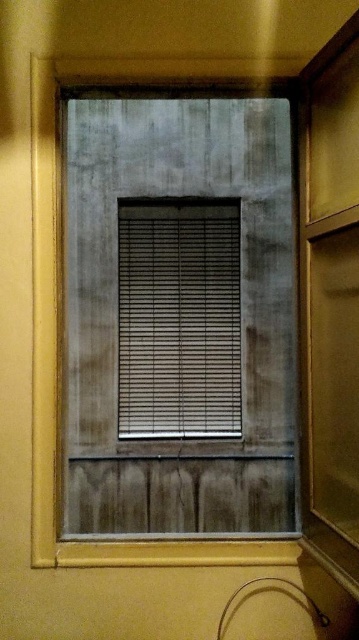
You are a painter standing 1.5 meters away from a matte gray window at center. You want to paint the window but need to be at least 2 meters away to avoid splatter. Is your current distance safe?

The matte gray window at center is 2.39 meters from camera. Since you are standing 1.5 meters away, you are closer than the required 2 meters, so your current distance is not safe. Move back to at least 2 meters.

You are standing in a room with a matte gray window at center and matte gray blinds at center. Which object is positioned to the right side?

The matte gray window at center is positioned to the right of the matte gray blinds at center.

You are a painter standing in front of the matte gray window at center and the matte gray blinds at center. You want to paint the window but need to know which one is closer to you. Which object is closer to you?

The matte gray window at center is closer to you because it is in front of the matte gray blinds at center.